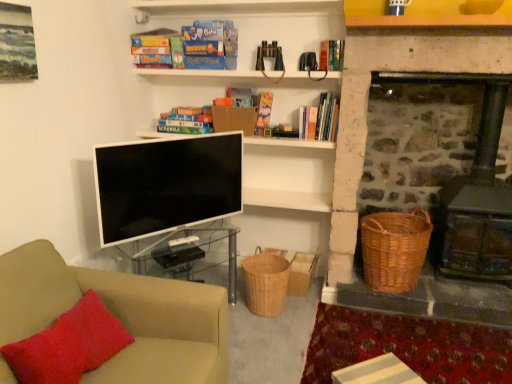
Image resolution: width=512 pixels, height=384 pixels. Describe the element at coordinates (265, 282) in the screenshot. I see `woven brown basket at lower center, which appears as the first basket when viewed from the left` at that location.

What do you see at coordinates (377, 372) in the screenshot?
I see `white striped wood table at lower center` at bounding box center [377, 372].

This screenshot has width=512, height=384. In order to click on woven brown basket at right, the 1th basket in the right-to-left sequence in this screenshot , I will do `click(394, 249)`.

Find the location of a particular element. dark brown wood stove at right is located at coordinates (445, 164).

Measure the distance between point (147, 45) and camera.

Point (147, 45) and camera are 2.75 meters apart.

At what (x,y) coordinates should I click in order to perform the action: click on matte cardboard book at upper center, marked as the fourth book in a left-to-right arrangement. Please return your answer as a coordinate pair (x, y). Looking at the image, I should click on [263, 113].

The width and height of the screenshot is (512, 384). In order to click on woven brown basket at lower center, the third basket from the right in this screenshot , I will do `click(265, 282)`.

Between hardcover book at upper center, the 5th book from the left, and blue cardboard game at upper center, the third book from the left, which one has smaller size?

hardcover book at upper center, the 5th book from the left.

Between hardcover book at upper center, the 5th book from the left, and blue cardboard game at upper center, the third book from the left, which one has less height?

With less height is hardcover book at upper center, the 5th book from the left.

Considering the sizes of objects hardcover book at upper center, the 5th book from the left, and blue cardboard game at upper center, which is the 3th book from right to left, in the image provided, who is thinner, hardcover book at upper center, the 5th book from the left, or blue cardboard game at upper center, which is the 3th book from right to left,?

Thinner between the two is hardcover book at upper center, the 5th book from the left.

From the image's perspective, is hardcover book at upper center, the 5th book from the left, positioned above or below blue cardboard game at upper center, which is the 3th book from right to left?

hardcover book at upper center, the 5th book from the left, is situated lower than blue cardboard game at upper center, which is the 3th book from right to left, in the image.

Who is bigger, woven brown basket at right, the 1th basket in the right-to-left sequence, or hardcover book at upper center, placed as the 1th book when sorted from right to left?

Bigger between the two is woven brown basket at right, the 1th basket in the right-to-left sequence.

Which is behind, woven brown basket at right, which is the third basket in left-to-right order, or hardcover book at upper center, placed as the 1th book when sorted from right to left?

hardcover book at upper center, placed as the 1th book when sorted from right to left, is further from the camera.

Can you confirm if woven brown basket at right, which is the third basket in left-to-right order, is shorter than hardcover book at upper center, placed as the 1th book when sorted from right to left?

Incorrect, the height of woven brown basket at right, which is the third basket in left-to-right order, does not fall short of that of hardcover book at upper center, placed as the 1th book when sorted from right to left.

Considering the points (291, 295) and (325, 42), which point is behind, point (291, 295) or point (325, 42)?

The point (291, 295) is farther.

How distant is woven brown basket at lower center, which is the second basket from left to right, from hardcover book at upper center, the 5th book from the left?

4.19 feet.

From a real-world perspective, is woven brown basket at lower center, which is the second basket from left to right, physically above hardcover book at upper center, the 5th book from the left?

No, from a real-world perspective, woven brown basket at lower center, which is the second basket from left to right, is not on top of hardcover book at upper center, the 5th book from the left.

From the image's perspective, does woven brown basket at lower center, positioned as the second basket in right-to-left order, appear higher than hardcover book at upper center, placed as the 1th book when sorted from right to left?

No.

From a real-world perspective, relative to woven brown basket at lower center, the third basket from the right, is matte cardboard book at upper center, marked as the fourth book in a left-to-right arrangement, vertically above or below?

Clearly, from a real-world perspective, matte cardboard book at upper center, marked as the fourth book in a left-to-right arrangement, is above woven brown basket at lower center, the third basket from the right.

From the image's perspective, is matte cardboard book at upper center, acting as the 2th book starting from the right, below woven brown basket at lower center, the third basket from the right?

Actually, matte cardboard book at upper center, acting as the 2th book starting from the right, appears above woven brown basket at lower center, the third basket from the right, in the image.

In the scene shown: Who is taller, matte cardboard book at upper center, acting as the 2th book starting from the right, or woven brown basket at lower center, which appears as the first basket when viewed from the left?

woven brown basket at lower center, which appears as the first basket when viewed from the left, is taller.

Is matte cardboard book at upper center, acting as the 2th book starting from the right, far away from woven brown basket at lower center, the third basket from the right?

No.

Is matte cardboard book at upper center, which is the fourth book in right-to-left order, to the left or to the right of blue cardboard game at upper center, the third book from the left, in the image?

In the image, matte cardboard book at upper center, which is the fourth book in right-to-left order, appears on the left side of blue cardboard game at upper center, the third book from the left.

Would you say matte cardboard book at upper center, the second book in the left-to-right sequence, is inside or outside blue cardboard game at upper center, the third book from the left?

matte cardboard book at upper center, the second book in the left-to-right sequence, is not inside blue cardboard game at upper center, the third book from the left, it's outside.

Is matte cardboard book at upper center, the second book in the left-to-right sequence, bigger or smaller than blue cardboard game at upper center, the third book from the left?

In the image, matte cardboard book at upper center, the second book in the left-to-right sequence, appears to be smaller than blue cardboard game at upper center, the third book from the left.

Is white striped wood table at lower center at the back of white glossy television at center?

No.

Who is shorter, white glossy television at center or white striped wood table at lower center?

white striped wood table at lower center is shorter.

Which is correct: white glossy television at center is inside white striped wood table at lower center, or outside of it?

The correct answer is: outside.

Find the location of a particular element. table below the white glossy television at center (from the image's perspective) is located at coordinates (377, 372).

Considering the relative sizes of white striped paper at lower right and woven brown basket at lower center, the third basket from the right, in the image provided, is white striped paper at lower right thinner than woven brown basket at lower center, the third basket from the right,?

No, white striped paper at lower right is not thinner than woven brown basket at lower center, the third basket from the right.

Is white striped paper at lower right oriented towards woven brown basket at lower center, the third basket from the right?

No, white striped paper at lower right is not aimed at woven brown basket at lower center, the third basket from the right.

Is white striped paper at lower right not within woven brown basket at lower center, which appears as the first basket when viewed from the left?

Yes.

From a real-world perspective, is white striped paper at lower right under woven brown basket at lower center, which appears as the first basket when viewed from the left?

Correct, in the physical world, white striped paper at lower right is lower than woven brown basket at lower center, which appears as the first basket when viewed from the left.

At what (x,y) coordinates should I click in order to perform the action: click on book that is the 2nd object directly below the blue cardboard game at upper center, the third book from the left (from a real-world perspective). Please return your answer as a coordinate pair (x, y). This screenshot has width=512, height=384. Looking at the image, I should click on (331, 55).

Locate an element on the screen. basket located on the right of hardcover book at upper center, placed as the 1th book when sorted from right to left is located at coordinates (394, 249).

When comparing their distances from white striped wood table at lower center, does dark brown wood stove at right or woven brown basket at lower center, positioned as the second basket in right-to-left order, seem closer?

Among the two, woven brown basket at lower center, positioned as the second basket in right-to-left order, is located nearer to white striped wood table at lower center.

Estimate the real-world distances between objects in this image. Which object is further from blue cardboard game at upper center, the third book from the left, hardcover book at upper center, the 5th book from the left, or dark brown wood stove at right?

dark brown wood stove at right.

Looking at the image, which one is located closer to woven brown basket at lower center, the third basket from the right, blue cardboard game at upper center, the third book from the left, or beige fabric couch at lower left?

beige fabric couch at lower left is positioned closer to the anchor woven brown basket at lower center, the third basket from the right.

Looking at the image, which one is located closer to matte cardboard book at upper center, which is the fourth book in right-to-left order, white striped wood table at lower center or dark brown wood stove at right?

Based on the image, dark brown wood stove at right appears to be nearer to matte cardboard book at upper center, which is the fourth book in right-to-left order.

Considering their positions, is woven brown basket at lower center, which is the second basket from left to right, positioned closer to blue cardboard game at upper center, the third book from the left, than matte cardboard book at upper center, arranged as the 5th book when viewed from the right?

matte cardboard book at upper center, arranged as the 5th book when viewed from the right, lies closer to blue cardboard game at upper center, the third book from the left, than the other object.

Considering their positions, is white striped paper at lower right positioned further to beige fabric couch at lower left than woven brown basket at right, the 1th basket in the right-to-left sequence?

Among the two, woven brown basket at right, the 1th basket in the right-to-left sequence, is located further to beige fabric couch at lower left.

When comparing their distances from white striped wood table at lower center, does dark brown wood stove at right or matte cardboard book at upper center, which is the fourth book in right-to-left order, seem further?

matte cardboard book at upper center, which is the fourth book in right-to-left order, is further to white striped wood table at lower center.

Which object lies further to the anchor point white striped paper at lower right, matte cardboard book at upper center, marked as the fourth book in a left-to-right arrangement, or blue cardboard game at upper center, which is the 3th book from right to left?

blue cardboard game at upper center, which is the 3th book from right to left.

Find the location of a particular element. Image resolution: width=512 pixels, height=384 pixels. table between beige fabric couch at lower left and woven brown basket at right, which is the third basket in left-to-right order, in the horizontal direction is located at coordinates (377, 372).

Locate an element on the screen. This screenshot has width=512, height=384. plain between matte cardboard book at upper center, which ranks as the 1th book in left-to-right order, and white striped wood table at lower center, in the vertical direction is located at coordinates (408, 346).

This screenshot has width=512, height=384. What are the coordinates of `plain between blue cardboard game at upper center, which is the 3th book from right to left, and white striped wood table at lower center in the up-down direction` in the screenshot? It's located at (408, 346).

The width and height of the screenshot is (512, 384). Identify the location of table between woven brown basket at lower center, positioned as the second basket in right-to-left order, and dark brown wood stove at right from left to right. (377, 372).